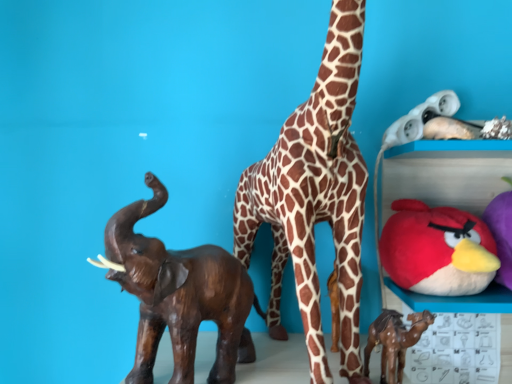
Where is `brown glossy camel at lower right, which is the second toy in left-to-right order`? This screenshot has width=512, height=384. brown glossy camel at lower right, which is the second toy in left-to-right order is located at coordinates (394, 341).

In order to face brown spotted fabric giraffe at center, should I rotate leftwards or rightwards?

You should rotate right by 7.787 degrees.

What do you see at coordinates (179, 295) in the screenshot? I see `brown wooden elephant at left, placed as the first toy when sorted from left to right` at bounding box center [179, 295].

This screenshot has height=384, width=512. I want to click on soft plush bird at right, which appears as the fourth toy when viewed from the left, so click(x=501, y=234).

Where is `red plush toy at upper right, the second toy when ordered from right to left`? This screenshot has height=384, width=512. red plush toy at upper right, the second toy when ordered from right to left is located at coordinates (437, 250).

You are a GUI agent. You are given a task and a screenshot of the screen. Output one action in this format:
    pyautogui.click(x=<x>, y=<y>)
    Task: Click on the brown glossy camel at lower right, which is the second toy in left-to-right order
    This screenshot has height=384, width=512.
    Given the screenshot: What is the action you would take?
    pyautogui.click(x=394, y=341)

Find the location of `the 3rd toy to the right of the brown spotted fabric giraffe at center, counting from the anchor's position`. the 3rd toy to the right of the brown spotted fabric giraffe at center, counting from the anchor's position is located at coordinates (501, 234).

From the image's perspective, relative to brown spotted fabric giraffe at center, is soft plush bird at right, which appears as the fourth toy when viewed from the left, above or below?

From the image's perspective, soft plush bird at right, which appears as the fourth toy when viewed from the left, appears below brown spotted fabric giraffe at center.

Which is in front, soft plush bird at right, which appears as the fourth toy when viewed from the left, or brown spotted fabric giraffe at center?

brown spotted fabric giraffe at center is in front.

Considering the relative sizes of soft plush bird at right, which appears as the fourth toy when viewed from the left, and brown spotted fabric giraffe at center in the image provided, is soft plush bird at right, which appears as the fourth toy when viewed from the left, thinner than brown spotted fabric giraffe at center?

Yes.

Is point (383, 324) positioned in front of point (502, 256)?

That is True.

Could you measure the distance between brown glossy camel at lower right, the 3th toy positioned from the right, and soft plush bird at right, which appears as the fourth toy when viewed from the left?

brown glossy camel at lower right, the 3th toy positioned from the right, and soft plush bird at right, which appears as the fourth toy when viewed from the left, are 8.87 inches apart from each other.

In the scene shown: Which is more to the right, brown glossy camel at lower right, which is the second toy in left-to-right order, or soft plush bird at right, which appears as the fourth toy when viewed from the left?

soft plush bird at right, which appears as the fourth toy when viewed from the left, is more to the right.

Is soft plush bird at right, the 1th toy when ordered from right to left, in front of brown wooden elephant at left, acting as the fourth toy starting from the right?

No, it is not.

Considering the relative positions of soft plush bird at right, the 1th toy when ordered from right to left, and brown wooden elephant at left, acting as the fourth toy starting from the right, in the image provided, is soft plush bird at right, the 1th toy when ordered from right to left, to the left of brown wooden elephant at left, acting as the fourth toy starting from the right, from the viewer's perspective?

Incorrect, soft plush bird at right, the 1th toy when ordered from right to left, is not on the left side of brown wooden elephant at left, acting as the fourth toy starting from the right.

Is soft plush bird at right, the 1th toy when ordered from right to left, facing towards brown wooden elephant at left, placed as the first toy when sorted from left to right?

No, soft plush bird at right, the 1th toy when ordered from right to left, is not oriented towards brown wooden elephant at left, placed as the first toy when sorted from left to right.

Does soft plush bird at right, which appears as the fourth toy when viewed from the left, have a larger size compared to brown wooden elephant at left, placed as the first toy when sorted from left to right?

No.

Which is farther from the camera, (x=310, y=315) or (x=241, y=336)?

Positioned behind is point (x=241, y=336).

At what (x,y) coordinates should I click in order to perform the action: click on the 3rd toy positioned below the brown spotted fabric giraffe at center (from the image's perspective). Please return your answer as a coordinate pair (x, y). Looking at the image, I should click on (179, 295).

Which of these two, brown spotted fabric giraffe at center or brown wooden elephant at left, placed as the first toy when sorted from left to right, stands taller?

With more height is brown spotted fabric giraffe at center.

Considering the relative positions of brown spotted fabric giraffe at center and brown wooden elephant at left, acting as the fourth toy starting from the right, in the image provided, is brown spotted fabric giraffe at center to the left or to the right of brown wooden elephant at left, acting as the fourth toy starting from the right,?

In the image, brown spotted fabric giraffe at center appears on the right side of brown wooden elephant at left, acting as the fourth toy starting from the right.

Is brown glossy camel at lower right, the 3th toy positioned from the right, positioned with its back to brown spotted fabric giraffe at center?

Yes, brown glossy camel at lower right, the 3th toy positioned from the right, is positioned with its back facing brown spotted fabric giraffe at center.

Is brown glossy camel at lower right, which is the second toy in left-to-right order, placed right next to brown spotted fabric giraffe at center?

brown glossy camel at lower right, which is the second toy in left-to-right order, and brown spotted fabric giraffe at center are not in contact.

Between brown glossy camel at lower right, the 3th toy positioned from the right, and brown spotted fabric giraffe at center, which one has less height?

With less height is brown glossy camel at lower right, the 3th toy positioned from the right.

Which object is thinner, brown glossy camel at lower right, the 3th toy positioned from the right, or brown spotted fabric giraffe at center?

Thinner between the two is brown glossy camel at lower right, the 3th toy positioned from the right.

Which is behind, brown spotted fabric giraffe at center or brown glossy camel at lower right, the 3th toy positioned from the right?

brown glossy camel at lower right, the 3th toy positioned from the right, is further from the camera.

Can you confirm if brown spotted fabric giraffe at center is smaller than brown glossy camel at lower right, which is the second toy in left-to-right order?

No, brown spotted fabric giraffe at center is not smaller than brown glossy camel at lower right, which is the second toy in left-to-right order.

In the scene shown: Which of these two, brown spotted fabric giraffe at center or brown glossy camel at lower right, the 3th toy positioned from the right, is thinner?

brown glossy camel at lower right, the 3th toy positioned from the right, is thinner.

From a real-world perspective, is brown spotted fabric giraffe at center physically below brown glossy camel at lower right, the 3th toy positioned from the right?

No, from a real-world perspective, brown spotted fabric giraffe at center is not under brown glossy camel at lower right, the 3th toy positioned from the right.

Could you measure the distance between brown wooden elephant at left, acting as the fourth toy starting from the right, and red plush toy at upper right, the second toy when ordered from right to left?

The distance of brown wooden elephant at left, acting as the fourth toy starting from the right, from red plush toy at upper right, the second toy when ordered from right to left, is 35.14 centimeters.

From the image's perspective, is brown wooden elephant at left, placed as the first toy when sorted from left to right, located above or below red plush toy at upper right, the second toy when ordered from right to left?

brown wooden elephant at left, placed as the first toy when sorted from left to right, is situated lower than red plush toy at upper right, the second toy when ordered from right to left, in the image.

From the picture: From a real-world perspective, which object stands above the other?

red plush toy at upper right, marked as the 3th toy in a left-to-right arrangement.

Looking at this image, could you tell me if brown wooden elephant at left, acting as the fourth toy starting from the right, is facing red plush toy at upper right, marked as the 3th toy in a left-to-right arrangement?

No, brown wooden elephant at left, acting as the fourth toy starting from the right, is not oriented towards red plush toy at upper right, marked as the 3th toy in a left-to-right arrangement.

Image resolution: width=512 pixels, height=384 pixels. There is a brown spotted fabric giraffe at center. In order to click on the 1st toy below it (from the image's perspective) in this screenshot , I will do `click(501, 234)`.

From the soft plush bird at right, the 1th toy when ordered from right to left, count 3rd toys forward and point to it. Please provide its 2D coordinates.

[(394, 341)]

When comparing their distances from soft plush bird at right, the 1th toy when ordered from right to left, does red plush toy at upper right, marked as the 3th toy in a left-to-right arrangement, or brown glossy camel at lower right, the 3th toy positioned from the right, seem closer?

Among the two, red plush toy at upper right, marked as the 3th toy in a left-to-right arrangement, is located nearer to soft plush bird at right, the 1th toy when ordered from right to left.

When comparing their distances from brown spotted fabric giraffe at center, does brown wooden elephant at left, acting as the fourth toy starting from the right, or brown glossy camel at lower right, the 3th toy positioned from the right, seem closer?

Among the two, brown wooden elephant at left, acting as the fourth toy starting from the right, is located nearer to brown spotted fabric giraffe at center.

Estimate the real-world distances between objects in this image. Which object is further from brown glossy camel at lower right, the 3th toy positioned from the right, brown spotted fabric giraffe at center or soft plush bird at right, which appears as the fourth toy when viewed from the left?

The object further to brown glossy camel at lower right, the 3th toy positioned from the right, is soft plush bird at right, which appears as the fourth toy when viewed from the left.

Which object lies further to the anchor point brown wooden elephant at left, acting as the fourth toy starting from the right, soft plush bird at right, which appears as the fourth toy when viewed from the left, or brown spotted fabric giraffe at center?

Among the two, soft plush bird at right, which appears as the fourth toy when viewed from the left, is located further to brown wooden elephant at left, acting as the fourth toy starting from the right.

Which object lies nearer to the anchor point soft plush bird at right, which appears as the fourth toy when viewed from the left, brown wooden elephant at left, acting as the fourth toy starting from the right, or red plush toy at upper right, the second toy when ordered from right to left?

red plush toy at upper right, the second toy when ordered from right to left.

Which object lies further to the anchor point brown glossy camel at lower right, the 3th toy positioned from the right, soft plush bird at right, which appears as the fourth toy when viewed from the left, or brown wooden elephant at left, placed as the first toy when sorted from left to right?

Among the two, brown wooden elephant at left, placed as the first toy when sorted from left to right, is located further to brown glossy camel at lower right, the 3th toy positioned from the right.

Based on their spatial positions, is brown wooden elephant at left, acting as the fourth toy starting from the right, or soft plush bird at right, the 1th toy when ordered from right to left, further from brown glossy camel at lower right, the 3th toy positioned from the right?

The object further to brown glossy camel at lower right, the 3th toy positioned from the right, is brown wooden elephant at left, acting as the fourth toy starting from the right.

Estimate the real-world distances between objects in this image. Which object is further from brown glossy camel at lower right, which is the second toy in left-to-right order, brown wooden elephant at left, acting as the fourth toy starting from the right, or red plush toy at upper right, marked as the 3th toy in a left-to-right arrangement?

brown wooden elephant at left, acting as the fourth toy starting from the right, lies further to brown glossy camel at lower right, which is the second toy in left-to-right order, than the other object.

Locate an element on the screen. Image resolution: width=512 pixels, height=384 pixels. giraffe between brown wooden elephant at left, placed as the first toy when sorted from left to right, and brown glossy camel at lower right, the 3th toy positioned from the right, from left to right is located at coordinates tap(315, 196).

At what (x,y) coordinates should I click in order to perform the action: click on toy situated between brown wooden elephant at left, placed as the first toy when sorted from left to right, and red plush toy at upper right, marked as the 3th toy in a left-to-right arrangement, from left to right. Please return your answer as a coordinate pair (x, y). Looking at the image, I should click on point(394,341).

The image size is (512, 384). I want to click on toy located between brown glossy camel at lower right, the 3th toy positioned from the right, and soft plush bird at right, the 1th toy when ordered from right to left, in the left-right direction, so 437,250.

This screenshot has height=384, width=512. In order to click on giraffe between brown wooden elephant at left, acting as the fourth toy starting from the right, and soft plush bird at right, the 1th toy when ordered from right to left, in the horizontal direction in this screenshot , I will do (x=315, y=196).